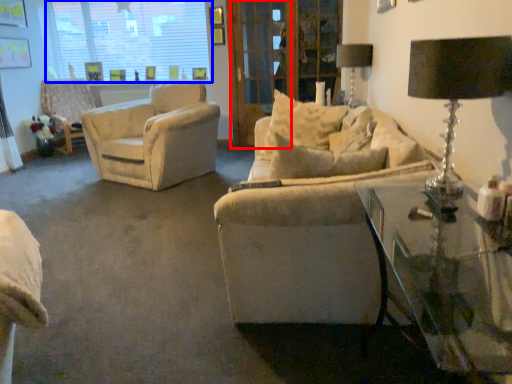
Question: Which point is closer to the camera, screen door (highlighted by a red box) or window (highlighted by a blue box)?

Choices:
 (A) screen door
 (B) window

Answer: (A)